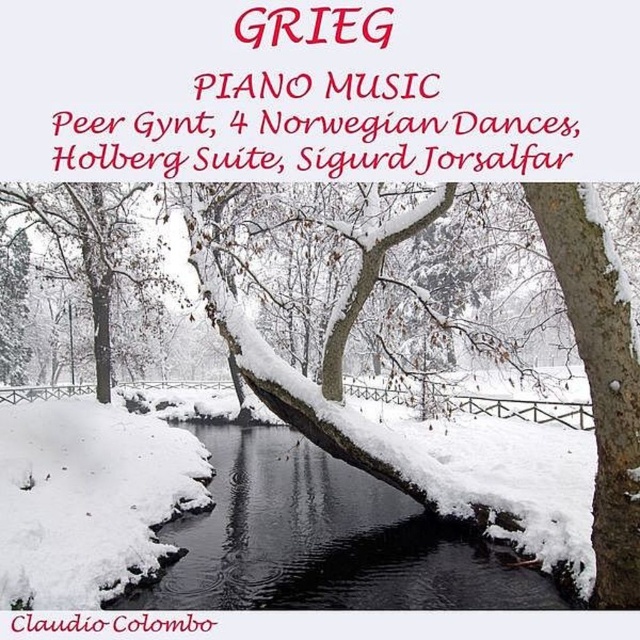
Who is positioned more to the right, snowy stone stream at center or white snow-covered tree at left?

Positioned to the right is snowy stone stream at center.

Is snowy stone stream at center below white snow-covered tree at left?

Yes, snowy stone stream at center is below white snow-covered tree at left.

Which is behind, point (474, 602) or point (109, 346)?

Positioned behind is point (109, 346).

The height and width of the screenshot is (640, 640). What are the coordinates of `snowy stone stream at center` in the screenshot? It's located at (324, 540).

Does snowy stone stream at center have a smaller size compared to snow-covered bark tree at center?

Indeed, snowy stone stream at center has a smaller size compared to snow-covered bark tree at center.

Can you confirm if snowy stone stream at center is positioned to the left of snow-covered bark tree at center?

No, snowy stone stream at center is not to the left of snow-covered bark tree at center.

Between point (220, 516) and point (406, 220), which one is positioned in front?

Point (406, 220) is in front.

You are a GUI agent. You are given a task and a screenshot of the screen. Output one action in this format:
    pyautogui.click(x=<x>, y=<y>)
    Task: Click on the snowy stone stream at center
    This screenshot has height=640, width=640.
    Given the screenshot: What is the action you would take?
    pyautogui.click(x=324, y=540)

Who is higher up, snow-covered bark tree at center or white snow-covered tree at left?

Positioned higher is white snow-covered tree at left.

Who is more forward, (x=595, y=355) or (x=90, y=193)?

Positioned in front is point (x=595, y=355).

Where is `snow-covered bark tree at center`? This screenshot has width=640, height=640. snow-covered bark tree at center is located at coordinates (600, 372).